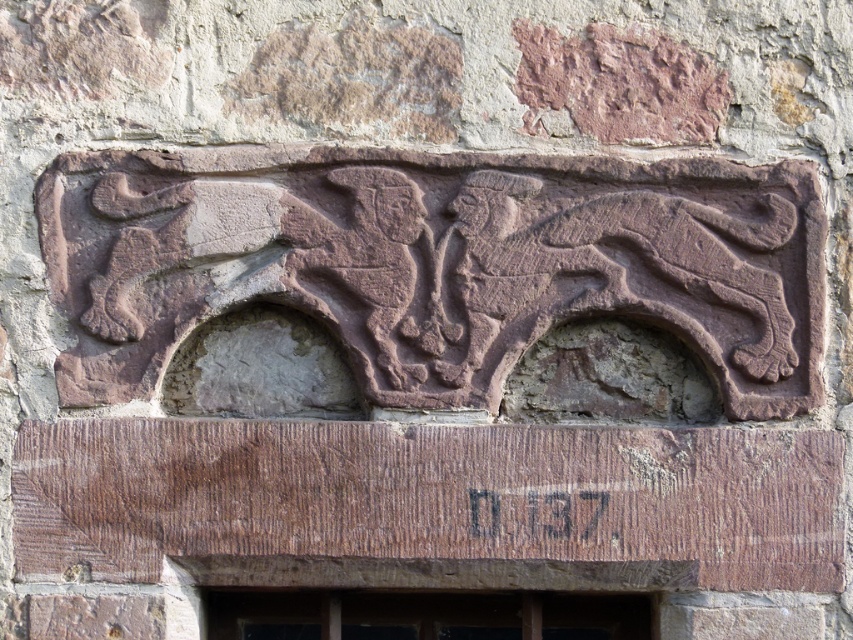
What are the coordinates of `brown stone plaque at center` in the screenshot? It's located at (427, 502).

Is brown stone plaque at center further to the viewer compared to transparent glass window at lower center?

No, brown stone plaque at center is closer to the viewer.

Measure the distance between point (x=138, y=490) and camera.

Point (x=138, y=490) and camera are 7.48 feet apart from each other.

Find the location of `brown stone plaque at center`. brown stone plaque at center is located at coordinates (427, 502).

In order to click on rustic stone carving at center in this screenshot , I will do `click(434, 262)`.

Who is more forward, (x=282, y=252) or (x=426, y=600)?

Point (x=282, y=252)

Between point (428, 241) and point (317, 620), which one is positioned in front?

Point (428, 241) is in front.

Image resolution: width=853 pixels, height=640 pixels. What are the coordinates of `rustic stone carving at center` in the screenshot? It's located at (434, 262).

Which is below, rustic stone carving at center or brown stone plaque at center?

brown stone plaque at center is lower down.

Can you confirm if rustic stone carving at center is bigger than brown stone plaque at center?

Indeed, rustic stone carving at center has a larger size compared to brown stone plaque at center.

This screenshot has height=640, width=853. I want to click on rustic stone carving at center, so click(x=434, y=262).

At what (x,y) coordinates should I click in order to perform the action: click on rustic stone carving at center. Please return your answer as a coordinate pair (x, y). The height and width of the screenshot is (640, 853). Looking at the image, I should click on (434, 262).